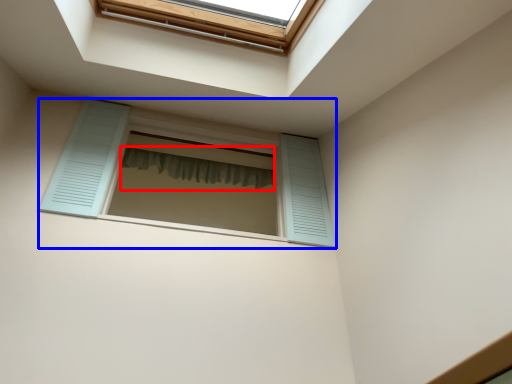
Question: Which of the following is the closest to the observer, shower curtain (highlighted by a red box) or window (highlighted by a blue box)?

Choices:
 (A) shower curtain
 (B) window

Answer: (B)